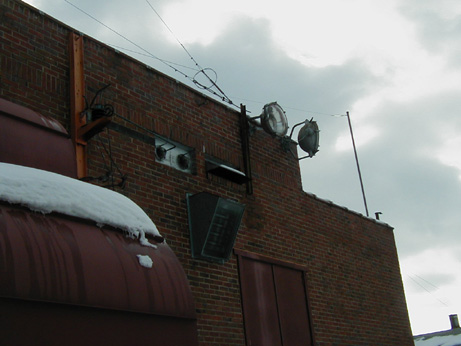
Find the location of a particular element. Image resolution: width=461 pixels, height=346 pixels. lights is located at coordinates (278, 131), (312, 137).